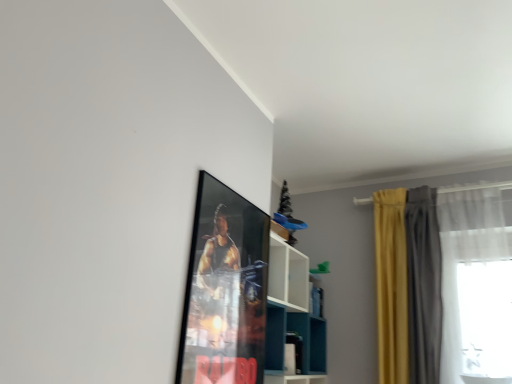
Question: Should I look upward or downward to see white glossy shelf at upper center?

Choices:
 (A) up
 (B) down

Answer: (B)

Question: Considering the relative positions of metallic poster at upper center and white sheer curtain at right, which ranks as the first curtain in right-to-left order, in the image provided, is metallic poster at upper center to the left of white sheer curtain at right, which ranks as the first curtain in right-to-left order, from the viewer's perspective?

Choices:
 (A) yes
 (B) no

Answer: (A)

Question: Does metallic poster at upper center have a greater height compared to white sheer curtain at right, marked as the 3th curtain in a left-to-right arrangement?

Choices:
 (A) no
 (B) yes

Answer: (A)

Question: Is metallic poster at upper center looking in the opposite direction of white sheer curtain at right, which ranks as the first curtain in right-to-left order?

Choices:
 (A) yes
 (B) no

Answer: (B)

Question: Could you tell me if metallic poster at upper center is facing white sheer curtain at right, marked as the 3th curtain in a left-to-right arrangement?

Choices:
 (A) no
 (B) yes

Answer: (A)

Question: Is metallic poster at upper center smaller than white sheer curtain at right, marked as the 3th curtain in a left-to-right arrangement?

Choices:
 (A) no
 (B) yes

Answer: (B)

Question: Is metallic poster at upper center bigger than white sheer curtain at right, marked as the 3th curtain in a left-to-right arrangement?

Choices:
 (A) yes
 (B) no

Answer: (B)

Question: From a real-world perspective, is yellow fabric curtain at right, the third curtain viewed from the right, on top of white glossy shelf at upper center?

Choices:
 (A) yes
 (B) no

Answer: (A)

Question: Considering the relative positions of yellow fabric curtain at right, positioned as the first curtain in left-to-right order, and white glossy shelf at upper center in the image provided, is yellow fabric curtain at right, positioned as the first curtain in left-to-right order, in front of white glossy shelf at upper center?

Choices:
 (A) no
 (B) yes

Answer: (A)

Question: Is yellow fabric curtain at right, the third curtain viewed from the right, wider than white glossy shelf at upper center?

Choices:
 (A) yes
 (B) no

Answer: (B)

Question: Can you confirm if yellow fabric curtain at right, the third curtain viewed from the right, is smaller than white glossy shelf at upper center?

Choices:
 (A) no
 (B) yes

Answer: (B)

Question: Are yellow fabric curtain at right, the third curtain viewed from the right, and white glossy shelf at upper center located far from each other?

Choices:
 (A) yes
 (B) no

Answer: (B)

Question: From the image's perspective, does yellow fabric curtain at right, positioned as the first curtain in left-to-right order, appear higher than white glossy shelf at upper center?

Choices:
 (A) yes
 (B) no

Answer: (A)

Question: Can you confirm if metallic poster at upper center is shorter than yellow fabric curtain at right, the third curtain viewed from the right?

Choices:
 (A) yes
 (B) no

Answer: (A)